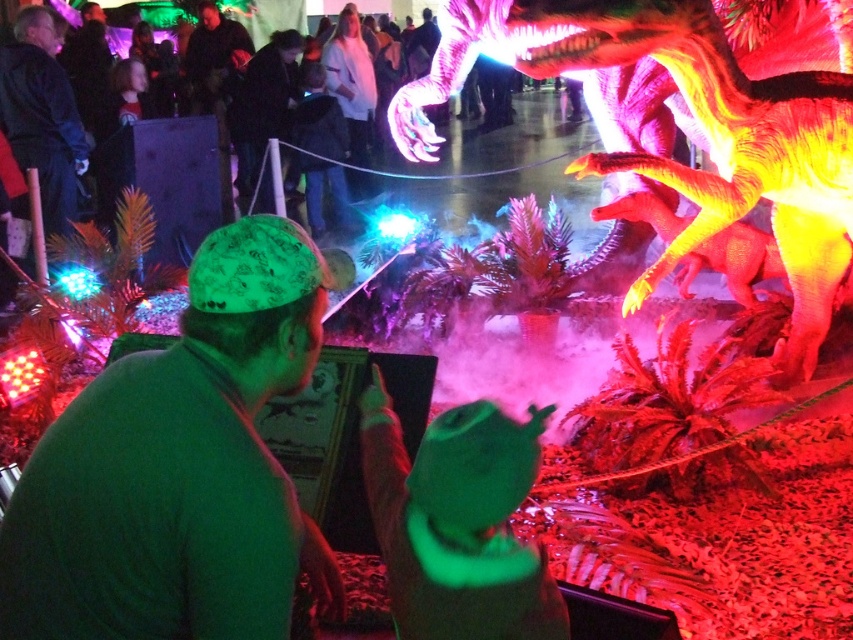
In the scene shown: Is green fabric cap at center positioned at the back of shiny plastic dinosaur at center?

No, it is not.

Does green fabric cap at center appear on the right side of shiny plastic dinosaur at center?

Incorrect, green fabric cap at center is not on the right side of shiny plastic dinosaur at center.

The height and width of the screenshot is (640, 853). Identify the location of green fabric cap at center. (181, 467).

Is green fabric cap at center positioned at the back of dark gray fabric jacket at center?

No, it is in front of dark gray fabric jacket at center.

Is point (296, 232) positioned after point (247, 108)?

That is False.

Identify the location of green fabric cap at center. Image resolution: width=853 pixels, height=640 pixels. (181, 467).

Does shiny plastic dinosaur at center have a lesser height compared to dark gray fabric jacket at center?

Incorrect, shiny plastic dinosaur at center's height does not fall short of dark gray fabric jacket at center's.

Is point (697, 195) positioned after point (254, 147)?

No, (697, 195) is closer to viewer.

Which is behind, point (779, 362) or point (285, 97)?

The point (285, 97) is behind.

The width and height of the screenshot is (853, 640). What are the coordinates of `shiny plastic dinosaur at center` in the screenshot? It's located at (698, 124).